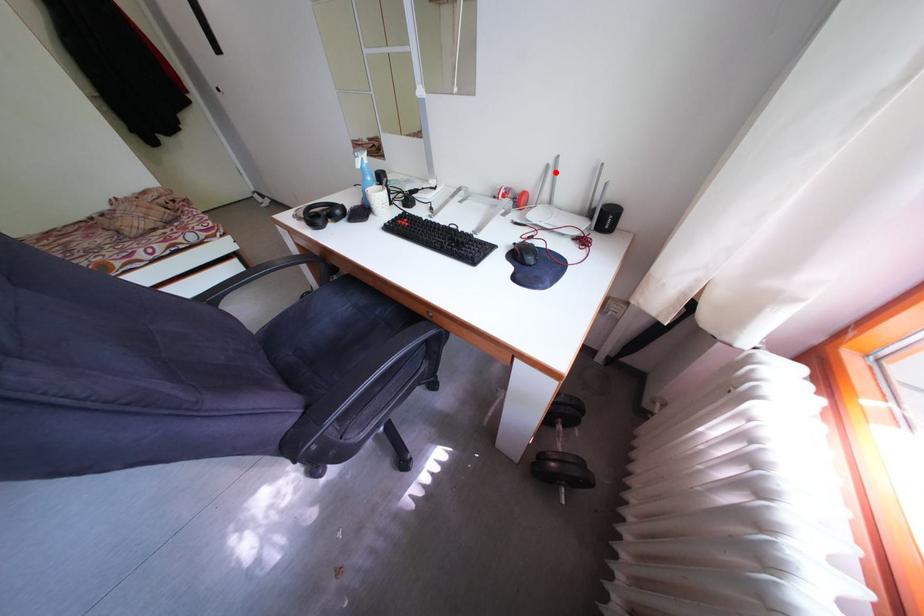
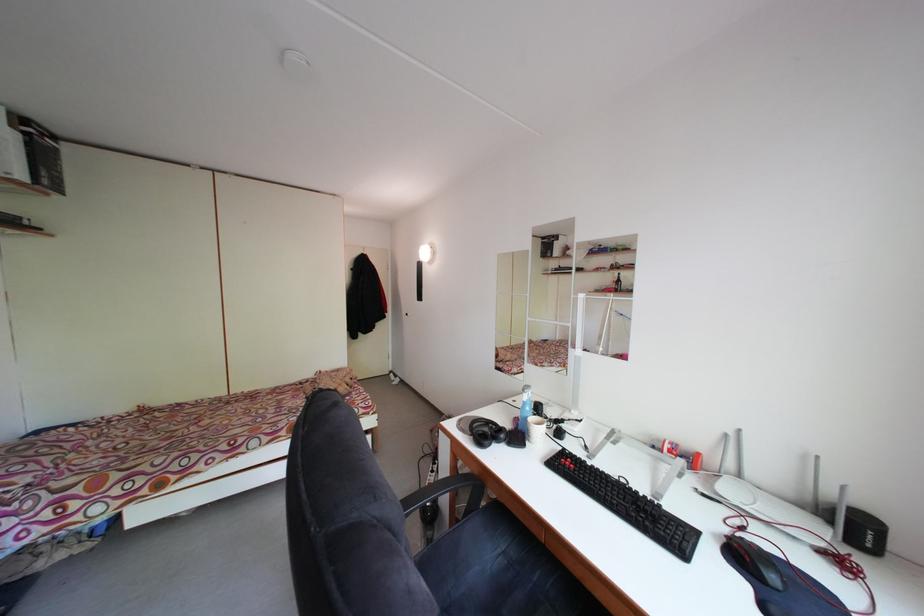
Question: I am providing you with two images of the same scene from different viewpoints. In image1, a red point is highlighted. Considering the same 3D point in image2, which of the following is correct?

Choices:
 (A) It is closer
 (B) It is farther

Answer: (B)